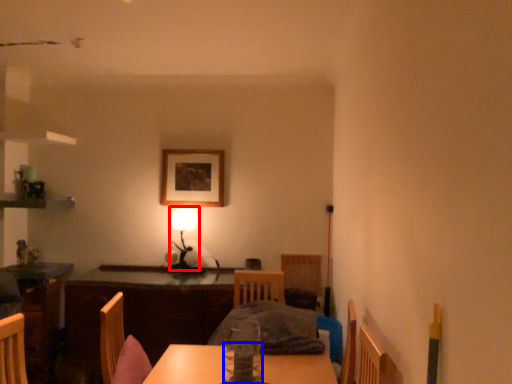
Question: Which of the following is the closest to the observer, table lamp (highlighted by a red box) or tableware (highlighted by a blue box)?

Choices:
 (A) table lamp
 (B) tableware

Answer: (B)